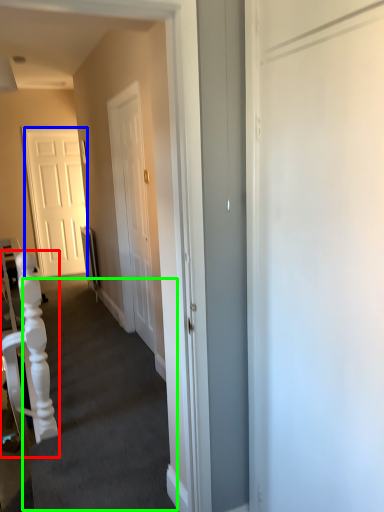
Question: Based on their relative distances, which object is farther from armchair (highlighted by a red box)? Choose from door (highlighted by a blue box) and stairwell (highlighted by a green box).

Choices:
 (A) door
 (B) stairwell

Answer: (A)